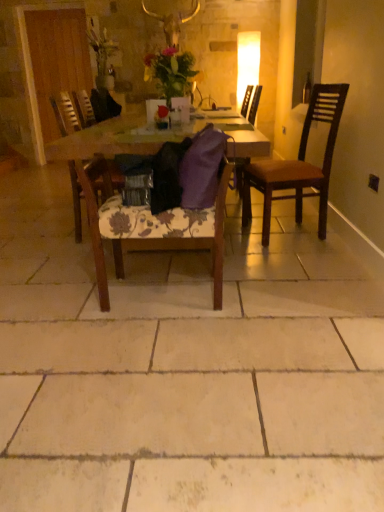
Question: From a real-world perspective, is transparent glass bottle at upper right positioned above or below wooden table at center?

Choices:
 (A) below
 (B) above

Answer: (B)

Question: In the image, is transparent glass bottle at upper right positioned in front of or behind wooden table at center?

Choices:
 (A) front
 (B) behind

Answer: (B)

Question: Which object is positioned closest to the transparent glass bottle at upper right?

Choices:
 (A) wooden chair at center, placed as the 2th chair when sorted from right to left
 (B) matte white lampshade at upper center
 (C) wooden chair at center, acting as the third chair starting from the right
 (D) wooden table at center
 (E) purple fabric pillow at center

Answer: (B)

Question: Which of these objects is positioned closest to the purple fabric pillow at center?

Choices:
 (A) matte floral arrangement at center
 (B) wooden chair at center, placed as the 2th chair when sorted from right to left
 (C) wooden table at center
 (D) matte white lampshade at upper center
 (E) wooden chair at center, the first chair positioned from the left

Answer: (B)